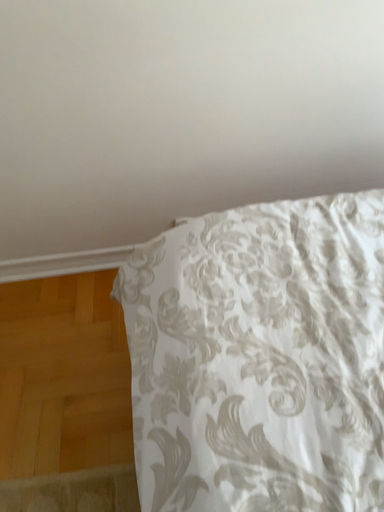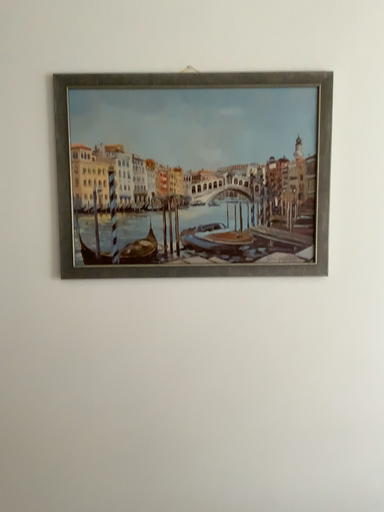
Question: Which way did the camera rotate in the video?

Choices:
 (A) rotated downward
 (B) rotated upward

Answer: (B)